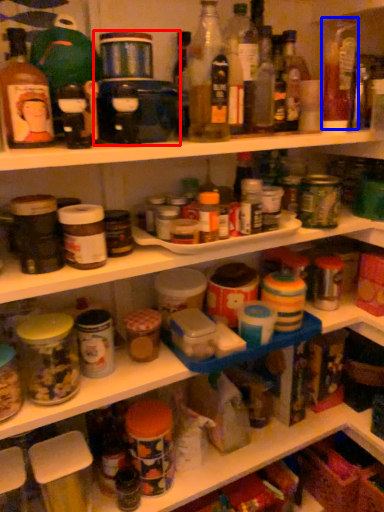
Question: Which point is closer to the camera, appliance (highlighted by a red box) or bottle (highlighted by a blue box)?

Choices:
 (A) appliance
 (B) bottle

Answer: (A)